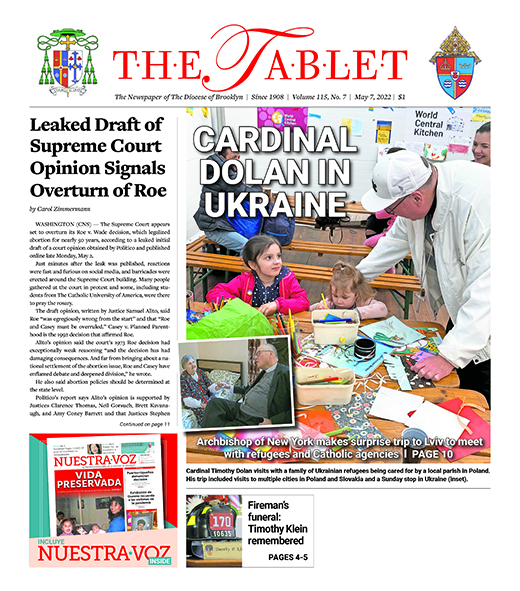
At what (x,y) coordinates should I click in order to perform the action: click on floor. Please return your answer as a coordinate pair (x, y). Looking at the image, I should click on (317, 284).